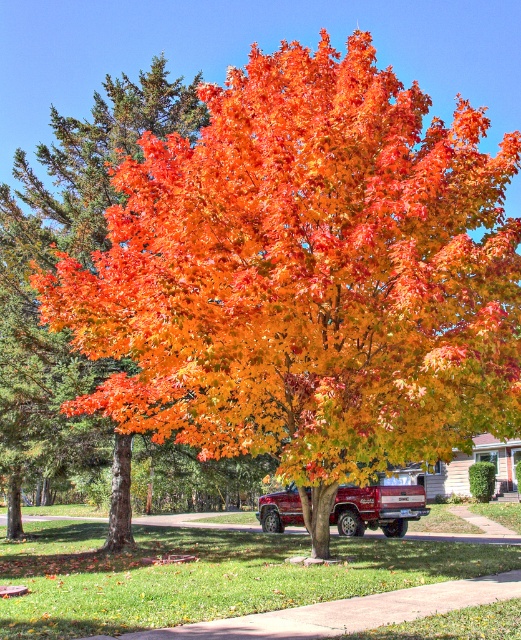
Question: Based on their relative distances, which object is nearer to the green grass at center?

Choices:
 (A) metallic red pickup truck at center
 (B) orange glossy tree at center

Answer: (A)

Question: Which point is closer to the camera?

Choices:
 (A) (279, 497)
 (B) (341, 544)
 (C) (76, 454)

Answer: (B)

Question: Which object is closer to the camera taking this photo?

Choices:
 (A) metallic red pickup truck at center
 (B) orange glossy tree at center
 (C) green grass at center

Answer: (C)

Question: Is green grass at center bigger than metallic red pickup truck at center?

Choices:
 (A) yes
 (B) no

Answer: (A)

Question: From the image, what is the correct spatial relationship of green grass at center in relation to orange glossy tree at center?

Choices:
 (A) left
 (B) right

Answer: (B)

Question: Does orange glossy tree at center have a larger size compared to metallic red pickup truck at center?

Choices:
 (A) yes
 (B) no

Answer: (A)